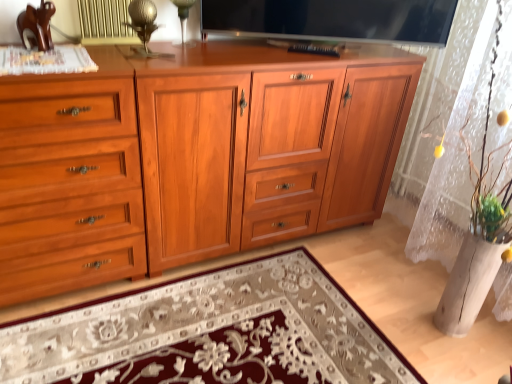
This screenshot has height=384, width=512. What are the coordinates of `free space above floral carpet at center (from a real-world perspective)` in the screenshot? It's located at (209, 327).